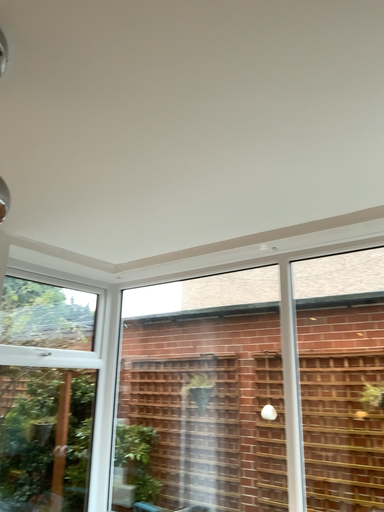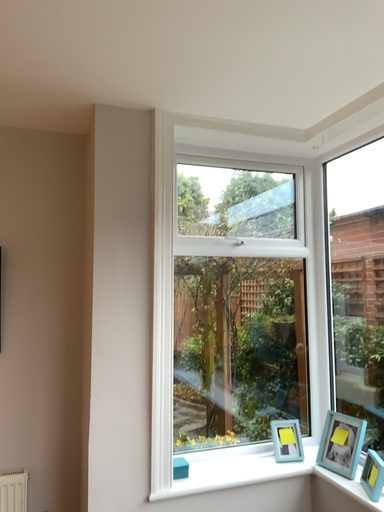
Question: How did the camera likely rotate when shooting the video?

Choices:
 (A) rotated right
 (B) rotated left

Answer: (B)